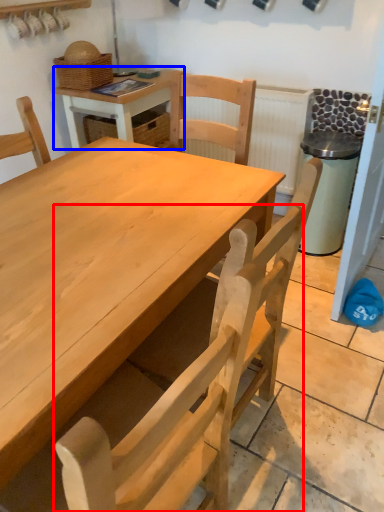
Question: Which object is further to the camera taking this photo, chair (highlighted by a red box) or table (highlighted by a blue box)?

Choices:
 (A) chair
 (B) table

Answer: (B)